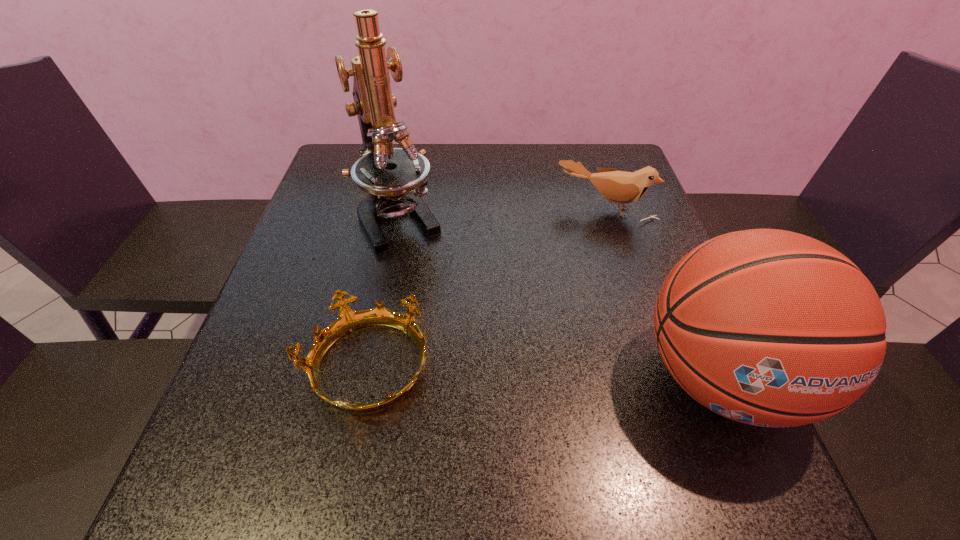
At what (x,y) coordinates should I click in order to perform the action: click on the shortest object. Please return your answer as a coordinate pair (x, y). Looking at the image, I should click on click(x=349, y=320).

The width and height of the screenshot is (960, 540). Identify the location of basketball. (767, 327).

What are the coordinates of `bird` in the screenshot? It's located at (618, 187).

The image size is (960, 540). I want to click on microscope, so click(x=396, y=178).

This screenshot has height=540, width=960. What are the coordinates of `blank space located 0.210m on the right of the crown` in the screenshot? It's located at (546, 368).

Locate an element on the screen. vacant space situated at the beak of the third tallest object is located at coordinates (560, 290).

Identify the location of vacant region located 0.400m at the beak of the third tallest object. tap(538, 342).

Identify the location of vacant region located 0.080m at the beak of the third tallest object. This screenshot has height=540, width=960. (581, 242).

The height and width of the screenshot is (540, 960). Identify the location of free space located at the eyepiece of the tallest object. (472, 343).

Identify the location of free location located at the eyepiece of the tallest object. (430, 274).